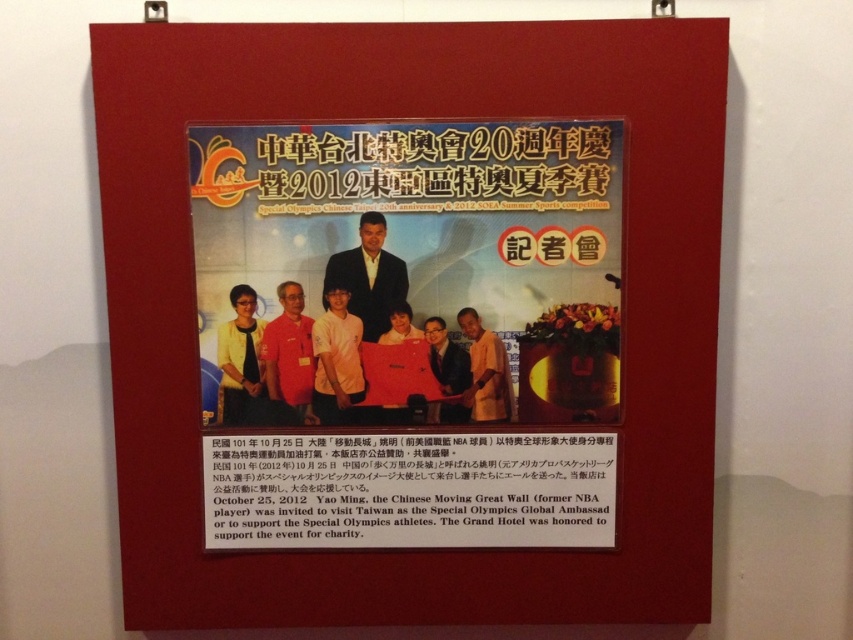
You are a GUI agent. You are given a task and a screenshot of the screen. Output one action in this format:
    pyautogui.click(x=<x>, y=<y>)
    Task: Click on the matte paper poster at center
    Image resolution: width=853 pixels, height=640 pixels.
    Given the screenshot: What is the action you would take?
    pyautogui.click(x=425, y=317)

What do you see at coordinates (425, 317) in the screenshot?
I see `matte paper poster at center` at bounding box center [425, 317].

Is point (399, 236) closer to viewer compared to point (454, 387)?

Yes.

The image size is (853, 640). What are the coordinates of `matte paper poster at center` in the screenshot? It's located at (425, 317).

Which is in front, point (544, 513) or point (223, 324)?

Point (223, 324) is more forward.

Does black paper at center have a larger size compared to matte black shirt at left?

Indeed, black paper at center has a larger size compared to matte black shirt at left.

Describe the element at coordinates (409, 490) in the screenshot. I see `black paper at center` at that location.

This screenshot has width=853, height=640. What are the coordinates of `black paper at center` in the screenshot? It's located at (409, 490).

Does black paper at center have a greater width compared to orange cotton shirt at center?

Indeed, black paper at center has a greater width compared to orange cotton shirt at center.

Is black paper at center above orange cotton shirt at center?

No, black paper at center is not above orange cotton shirt at center.

Who is more forward, (335, 488) or (357, 401)?

Point (357, 401)

Locate an element on the screen. The width and height of the screenshot is (853, 640). black paper at center is located at coordinates (409, 490).